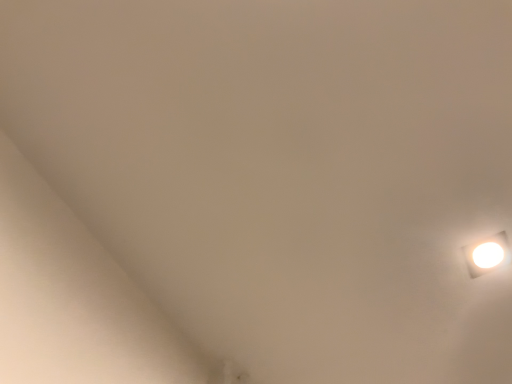
Image resolution: width=512 pixels, height=384 pixels. Describe the element at coordinates (487, 254) in the screenshot. I see `white glossy light fixture at upper right` at that location.

The width and height of the screenshot is (512, 384). I want to click on white glossy light fixture at upper right, so tap(487, 254).

Measure the distance between white glossy light fixture at upper right and camera.

They are 33.67 inches apart.

Find the location of a particular element. The image size is (512, 384). white glossy light fixture at upper right is located at coordinates (487, 254).